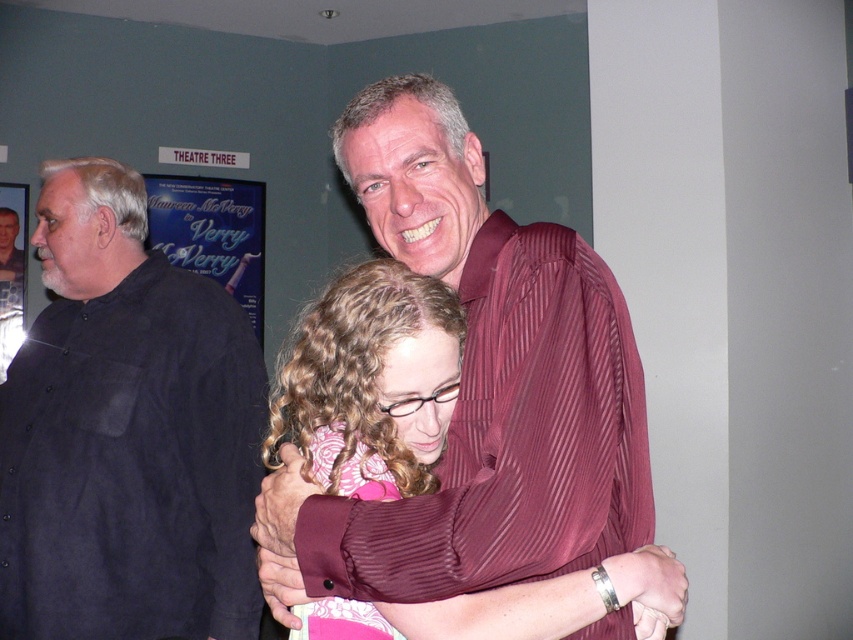
Is black matte shirt at left below pink fabric at center?

No.

Can you confirm if black matte shirt at left is wider than pink fabric at center?

Yes, black matte shirt at left is wider than pink fabric at center.

Locate an element on the screen. The width and height of the screenshot is (853, 640). black matte shirt at left is located at coordinates (126, 433).

Where is `black matte shirt at left`? black matte shirt at left is located at coordinates (126, 433).